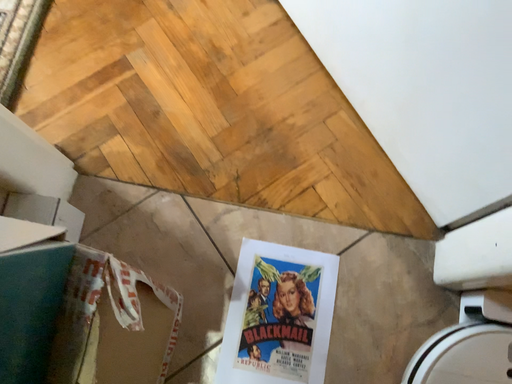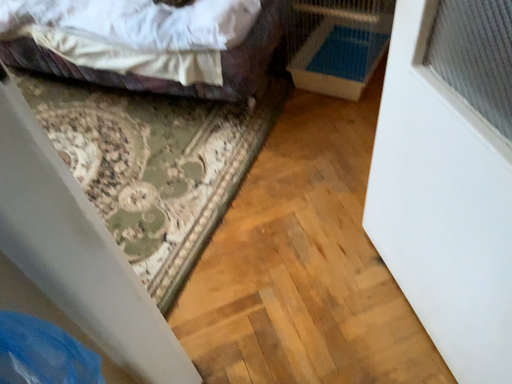
Question: Which way did the camera rotate in the video?

Choices:
 (A) rotated upward
 (B) rotated downward

Answer: (A)